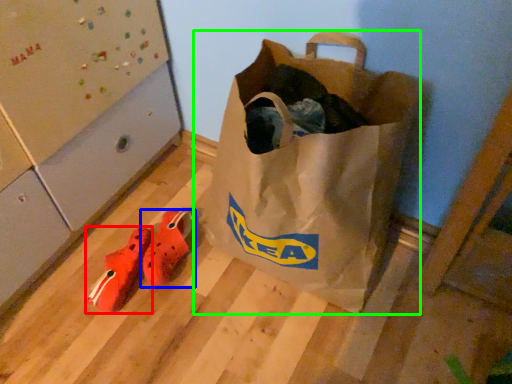
Question: Considering the real-world distances, which object is farthest from shoe (highlighted by a red box)? footwear (highlighted by a blue box) or luggage and bags (highlighted by a green box)?

Choices:
 (A) footwear
 (B) luggage and bags

Answer: (B)